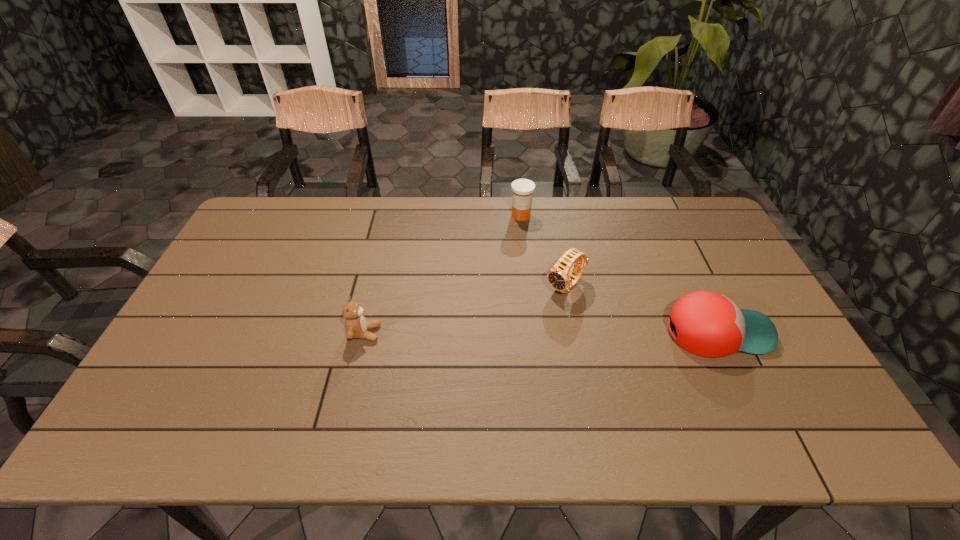
Image resolution: width=960 pixels, height=540 pixels. I want to click on vacant space at the far right corner of the desktop, so click(675, 232).

The width and height of the screenshot is (960, 540). In order to click on vacant space in between the leftmost object and the rightmost object in this screenshot , I will do `click(540, 333)`.

Where is `vacant space that's between the teddy bear and the medicine`? The width and height of the screenshot is (960, 540). vacant space that's between the teddy bear and the medicine is located at coordinates (443, 274).

This screenshot has height=540, width=960. What are the coordinates of `free area in between the baseball cap and the medicine` in the screenshot? It's located at (619, 274).

The image size is (960, 540). Identify the location of vacant space that's between the second farthest object and the rightmost object. (641, 309).

This screenshot has width=960, height=540. In order to click on vacant space that is in between the rightmost object and the leftmost object in this screenshot , I will do `click(540, 333)`.

Locate an element on the screen. The height and width of the screenshot is (540, 960). free point between the leftmost object and the second object from right to left is located at coordinates tap(465, 310).

This screenshot has height=540, width=960. I want to click on free spot between the rightmost object and the second farthest object, so click(641, 309).

I want to click on free area in between the third nearest object and the teddy bear, so click(x=465, y=310).

The image size is (960, 540). Find the location of `vacant space that's between the second object from left to right and the watch`. vacant space that's between the second object from left to right and the watch is located at coordinates (543, 251).